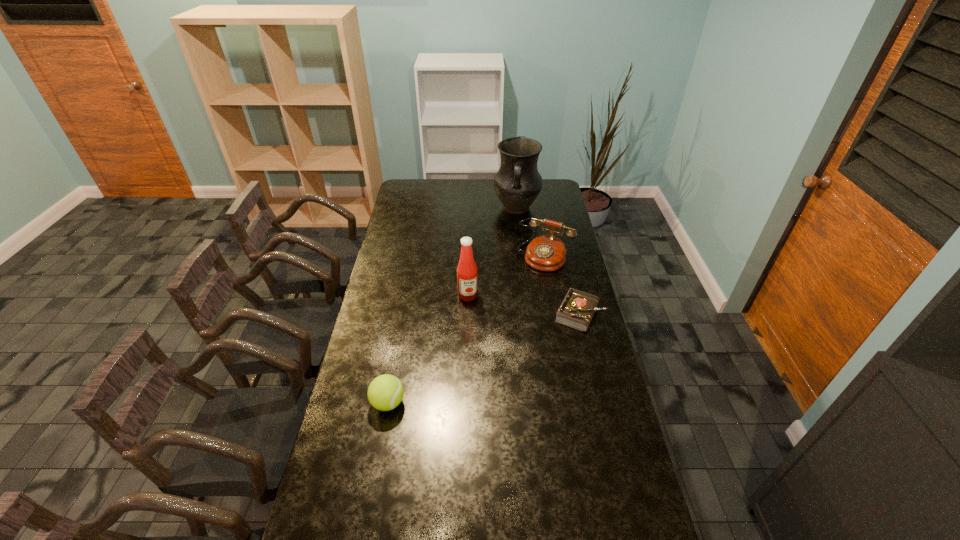
This screenshot has height=540, width=960. I want to click on free space on the desktop that is between the tennis ball and the shortest object and is positioned on the front-facing side of the condiment, so click(x=482, y=359).

What are the coordinates of `vacant space on the desktop that is between the nearest object and the shortest object and is positioned on the handle side of the tallest object` in the screenshot? It's located at (502, 350).

Locate an element on the screen. free space on the desktop that is between the tennis ball and the diary and is positioned on the dial of the fourth nearest object is located at coordinates (479, 360).